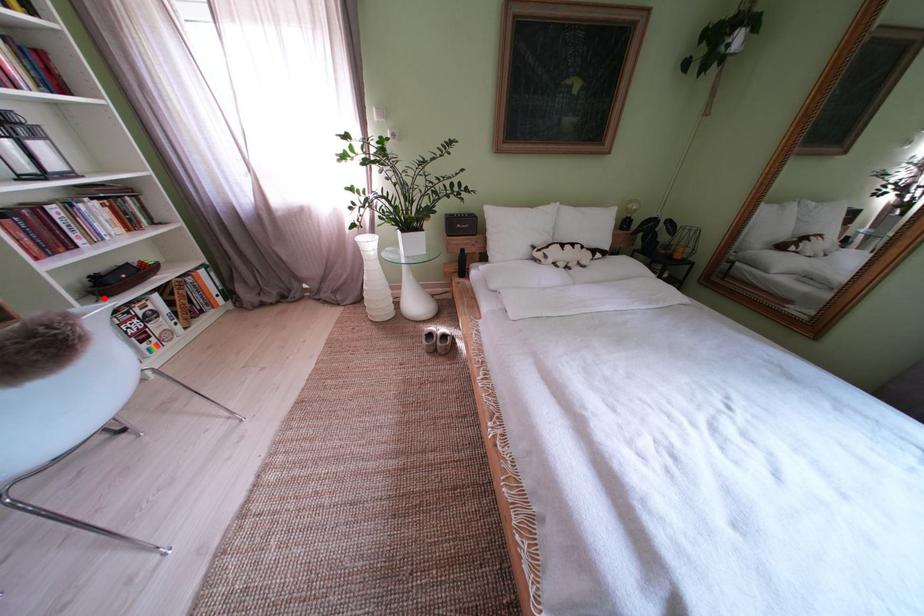
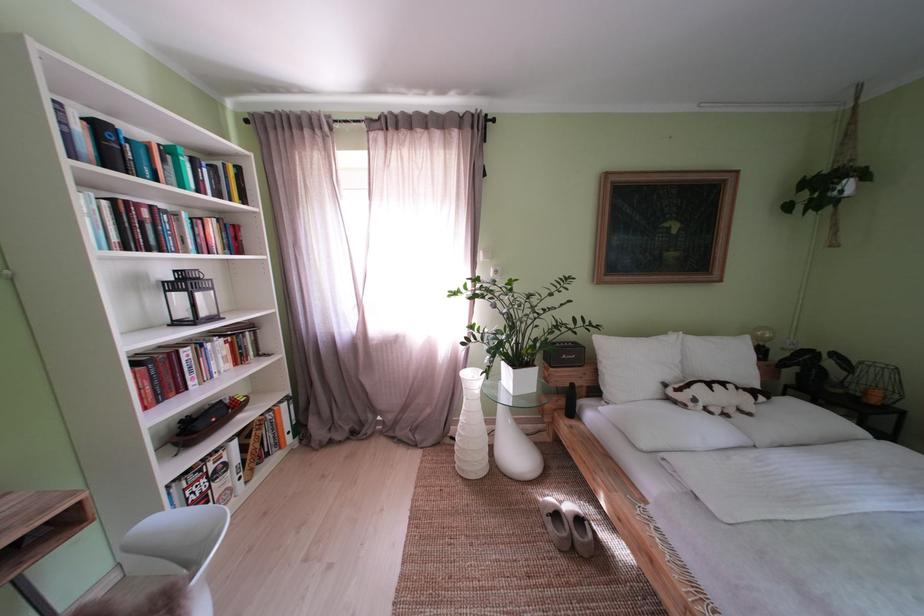
Question: I am providing you with two images of the same scene from different viewpoints. In image1, a red point is highlighted. Considering the same 3D point in image2, which of the following is correct?

Choices:
 (A) It is closer
 (B) It is farther

Answer: (A)